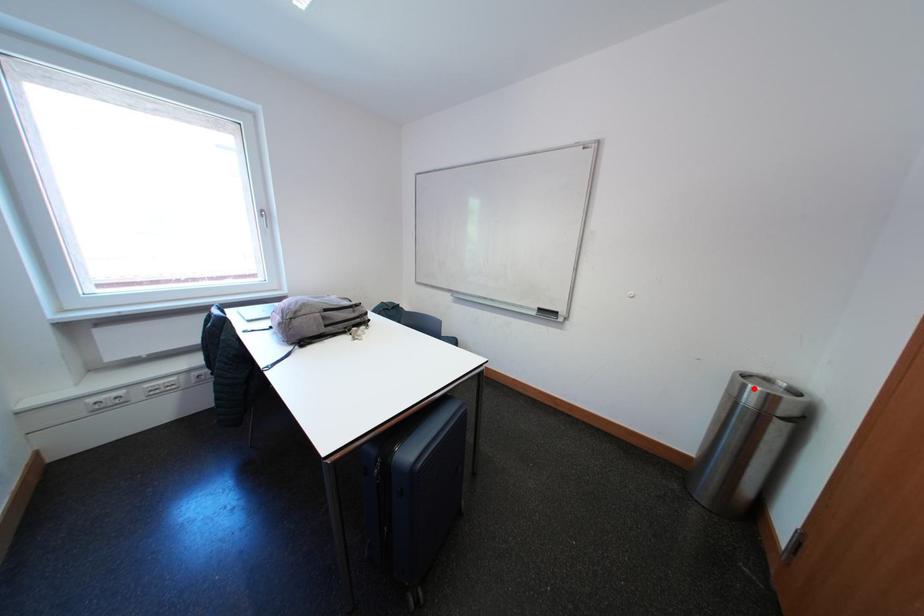
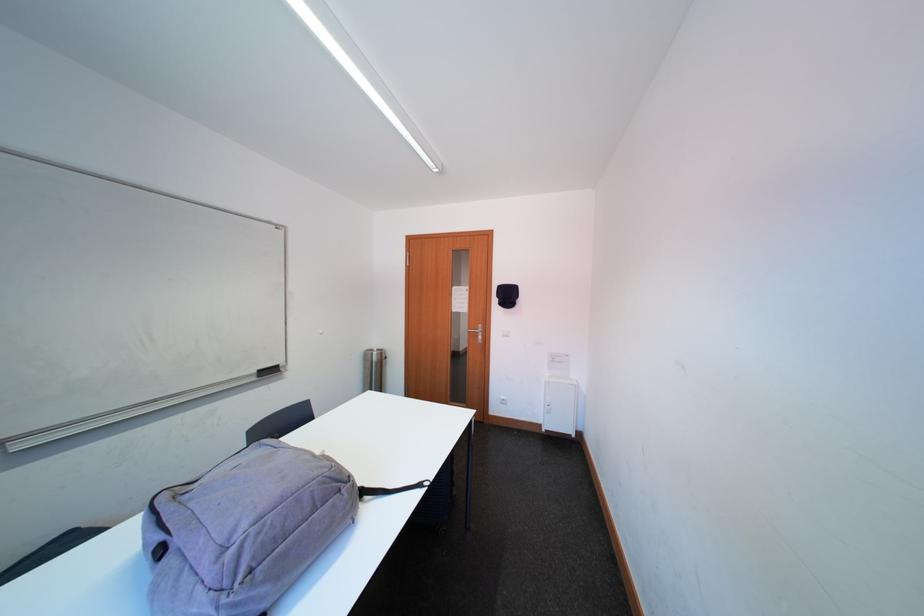
The point at the highlighted location is marked in the first image. Where is the corresponding point in the second image?

(382, 358)